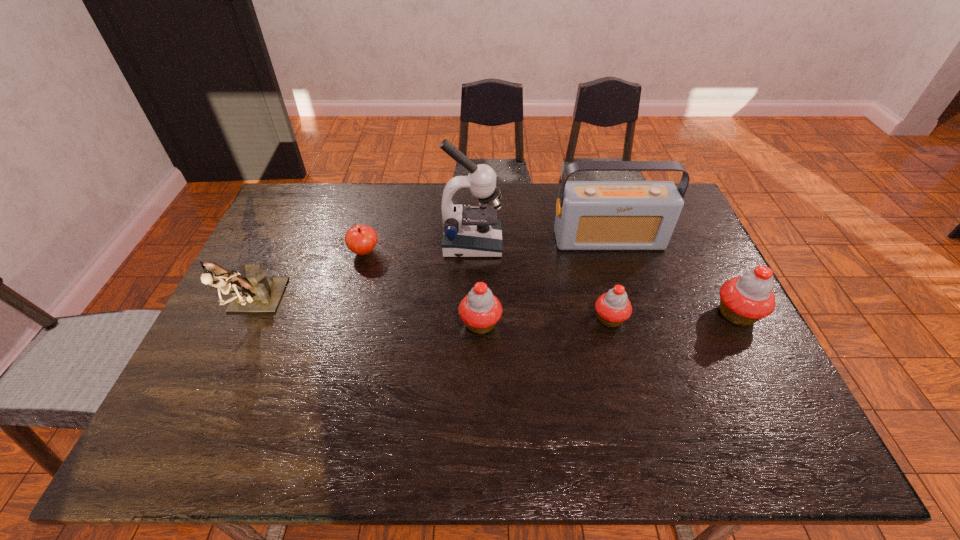
Where is `free space that satisfies the following two spatial constraints: 1. at the eyepiece of the tallest object; 2. on the right side of the rightmost object`? This screenshot has height=540, width=960. free space that satisfies the following two spatial constraints: 1. at the eyepiece of the tallest object; 2. on the right side of the rightmost object is located at coordinates (470, 314).

What are the coordinates of `vacant space that satisfies the following two spatial constraints: 1. on the front-facing side of the radio receiver; 2. at the eyepiece of the microscope` in the screenshot? It's located at (x=610, y=244).

At what (x,y) coordinates should I click in order to perform the action: click on vacant space that satisfies the following two spatial constraints: 1. on the front-facing side of the rightmost cupcake; 2. on the left side of the figurine. Please return your answer as a coordinate pair (x, y). Looking at the image, I should click on (251, 314).

You are a GUI agent. You are given a task and a screenshot of the screen. Output one action in this format:
    pyautogui.click(x=<x>, y=<y>)
    Task: Click on the free space that satisfies the following two spatial constraints: 1. at the eyepiece of the microscope; 2. on the front-facing side of the leftmost object
    
    Given the screenshot: What is the action you would take?
    pyautogui.click(x=470, y=306)